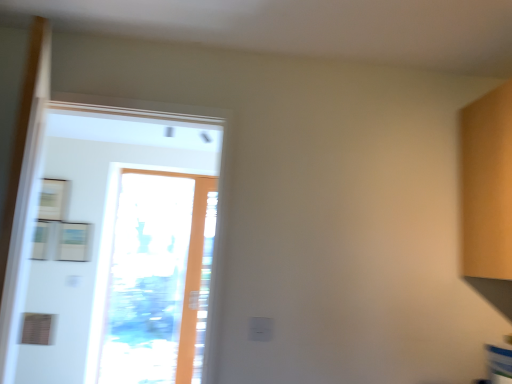
Question: Looking at their shapes, would you say transparent glass door at center is wider or thinner than transparent glass screen door at left?

Choices:
 (A) thin
 (B) wide

Answer: (A)

Question: From the image's perspective, is transparent glass door at center located above or below transparent glass screen door at left?

Choices:
 (A) below
 (B) above

Answer: (A)

Question: Considering the positions of point (187, 210) and point (97, 296), is point (187, 210) closer or farther from the camera than point (97, 296)?

Choices:
 (A) closer
 (B) farther

Answer: (B)

Question: Considering the positions of transparent glass screen door at left and transparent glass door at center in the image, is transparent glass screen door at left taller or shorter than transparent glass door at center?

Choices:
 (A) tall
 (B) short

Answer: (B)

Question: In the image, is transparent glass screen door at left positioned in front of or behind transparent glass door at center?

Choices:
 (A) front
 (B) behind

Answer: (A)

Question: From a real-world perspective, is transparent glass screen door at left physically located above or below transparent glass door at center?

Choices:
 (A) below
 (B) above

Answer: (B)

Question: Does point (152, 223) appear closer or farther from the camera than point (197, 253)?

Choices:
 (A) farther
 (B) closer

Answer: (A)